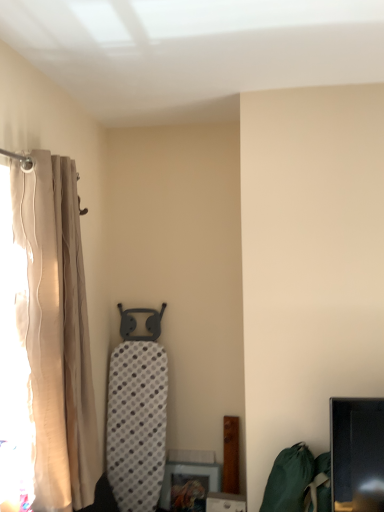
At what (x,y) coordinates should I click in order to perform the action: click on beige fabric curtain at left. Please return your answer as a coordinate pair (x, y). The width and height of the screenshot is (384, 512). Looking at the image, I should click on (56, 331).

What do you see at coordinates (56, 331) in the screenshot?
I see `beige fabric curtain at left` at bounding box center [56, 331].

This screenshot has width=384, height=512. What are the coordinates of `green fabric bean bag chair at lower right` in the screenshot? It's located at (298, 482).

The image size is (384, 512). What do you see at coordinates (298, 482) in the screenshot? I see `green fabric bean bag chair at lower right` at bounding box center [298, 482].

The image size is (384, 512). In order to click on beige fabric curtain at left in this screenshot , I will do `click(56, 331)`.

Considering the relative positions of beige fabric curtain at left and green fabric bean bag chair at lower right in the image provided, is beige fabric curtain at left to the left of green fabric bean bag chair at lower right from the viewer's perspective?

Correct, you'll find beige fabric curtain at left to the left of green fabric bean bag chair at lower right.

Is beige fabric curtain at left further to the viewer compared to green fabric bean bag chair at lower right?

That is False.

Considering the positions of point (56, 451) and point (293, 497), is point (56, 451) closer or farther from the camera than point (293, 497)?

Point (56, 451) is closer to the camera than point (293, 497).

From the image's perspective, is beige fabric curtain at left above or below green fabric bean bag chair at lower right?

beige fabric curtain at left is situated higher than green fabric bean bag chair at lower right in the image.

From a real-world perspective, between beige fabric curtain at left and green fabric bean bag chair at lower right, who is vertically higher?

beige fabric curtain at left is physically above.

In the scene shown: Between beige fabric curtain at left and green fabric bean bag chair at lower right, which one has smaller width?

beige fabric curtain at left is thinner.

Consider the image. Which of these two, beige fabric curtain at left or green fabric bean bag chair at lower right, stands shorter?

Standing shorter between the two is green fabric bean bag chair at lower right.

Does beige fabric curtain at left have a smaller size compared to green fabric bean bag chair at lower right?

Actually, beige fabric curtain at left might be larger than green fabric bean bag chair at lower right.

Would you say beige fabric curtain at left is inside or outside green fabric bean bag chair at lower right?

beige fabric curtain at left is not inside green fabric bean bag chair at lower right, it's outside.

Based on the photo, is beige fabric curtain at left beside green fabric bean bag chair at lower right?

No, beige fabric curtain at left is not next to green fabric bean bag chair at lower right.

Is beige fabric curtain at left facing towards green fabric bean bag chair at lower right?

Yes, beige fabric curtain at left is aimed at green fabric bean bag chair at lower right.

How different are the orientations of beige fabric curtain at left and green fabric bean bag chair at lower right in degrees?

They differ by 90.9 degrees in their facing directions.

How far apart are beige fabric curtain at left and green fabric bean bag chair at lower right?

A distance of 1.02 meters exists between beige fabric curtain at left and green fabric bean bag chair at lower right.

In order to click on bean bag chair below the beige fabric curtain at left (from the image's perspective) in this screenshot , I will do `click(298, 482)`.

Considering the positions of objects green fabric bean bag chair at lower right and beige fabric curtain at left in the image provided, who is more to the right, green fabric bean bag chair at lower right or beige fabric curtain at left?

green fabric bean bag chair at lower right is more to the right.

Which object is further away from the camera, green fabric bean bag chair at lower right or beige fabric curtain at left?

green fabric bean bag chair at lower right is further from the camera.

Is point (304, 479) closer to viewer compared to point (52, 497)?

No, it is not.

From the image's perspective, is green fabric bean bag chair at lower right below beige fabric curtain at left?

Indeed, from the image's perspective, green fabric bean bag chair at lower right is shown beneath beige fabric curtain at left.

From a real-world perspective, is green fabric bean bag chair at lower right above or below beige fabric curtain at left?

green fabric bean bag chair at lower right is below beige fabric curtain at left.

Between green fabric bean bag chair at lower right and beige fabric curtain at left, which one has larger width?

green fabric bean bag chair at lower right is wider.

In the scene shown: Considering the sizes of objects green fabric bean bag chair at lower right and beige fabric curtain at left in the image provided, who is shorter, green fabric bean bag chair at lower right or beige fabric curtain at left?

Standing shorter between the two is green fabric bean bag chair at lower right.

Can you confirm if green fabric bean bag chair at lower right is smaller than beige fabric curtain at left?

Yes.

Is green fabric bean bag chair at lower right not inside beige fabric curtain at left?

Yes, green fabric bean bag chair at lower right is located beyond the bounds of beige fabric curtain at left.

Is there a large distance between green fabric bean bag chair at lower right and beige fabric curtain at left?

Yes.

Is green fabric bean bag chair at lower right aimed at beige fabric curtain at left?

No, green fabric bean bag chair at lower right is not turned towards beige fabric curtain at left.

Looking at this image, how different are the orientations of green fabric bean bag chair at lower right and beige fabric curtain at left in degrees?

green fabric bean bag chair at lower right and beige fabric curtain at left are facing 90.9 degrees away from each other.

Measure the distance between green fabric bean bag chair at lower right and beige fabric curtain at left.

A distance of 3.36 feet exists between green fabric bean bag chair at lower right and beige fabric curtain at left.

This screenshot has width=384, height=512. What are the coordinates of `curtain lying in front of the green fabric bean bag chair at lower right` in the screenshot? It's located at (56, 331).

Locate an element on the screen. The width and height of the screenshot is (384, 512). bean bag chair on the right of beige fabric curtain at left is located at coordinates (298, 482).

Where is `bean bag chair beneath the beige fabric curtain at left (from a real-world perspective)`? This screenshot has width=384, height=512. bean bag chair beneath the beige fabric curtain at left (from a real-world perspective) is located at coordinates click(x=298, y=482).